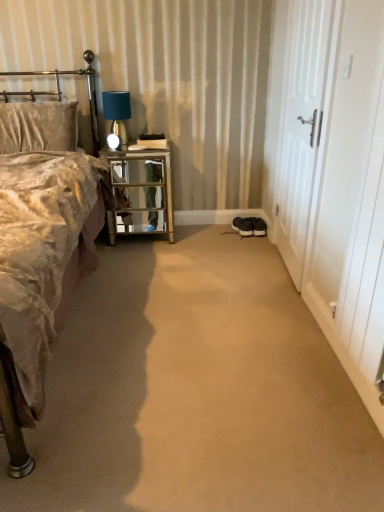
Question: From a real-world perspective, is metallic gold headboard at upper left above or below black suede sneakers at lower center?

Choices:
 (A) above
 (B) below

Answer: (A)

Question: From the image's perspective, is metallic gold headboard at upper left above or below black suede sneakers at lower center?

Choices:
 (A) above
 (B) below

Answer: (A)

Question: Which is nearer to the metallic gold headboard at upper left?

Choices:
 (A) white wooden door at right, the 2th screen door in the front-to-back sequence
 (B) black suede sneakers at lower center
 (C) metal/mirrored nightstand at left
 (D) white wooden screen door at right, the 2th screen door when ordered from back to front
 (E) velvet gold bed at left

Answer: (C)

Question: Estimate the real-world distances between objects in this image. Which object is closer to the white wooden door at right, the 2th screen door in the front-to-back sequence?

Choices:
 (A) metallic gold headboard at upper left
 (B) velvet gold bed at left
 (C) black suede sneakers at lower center
 (D) white wooden screen door at right, the 1th screen door viewed from the front
 (E) matte blue glass table lamp at upper left

Answer: (D)